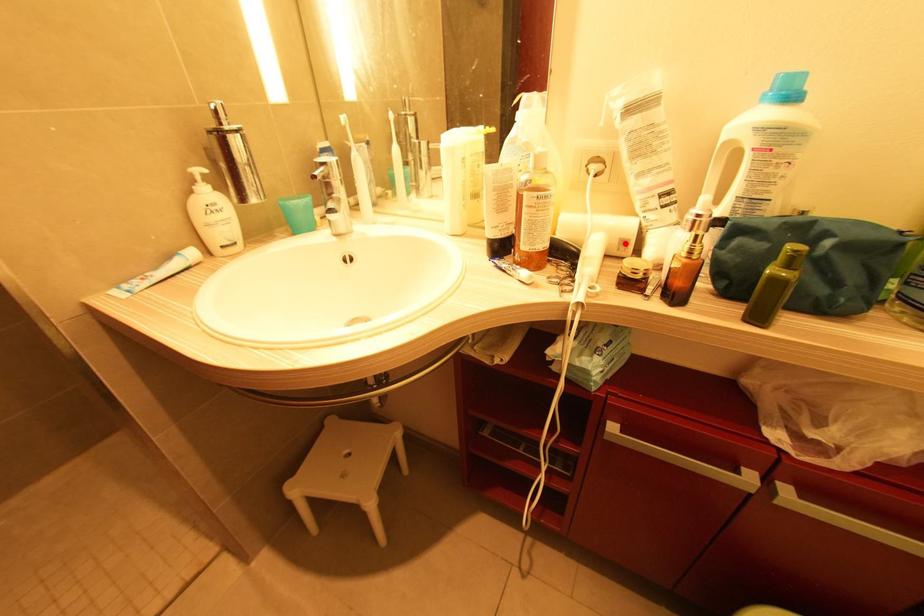
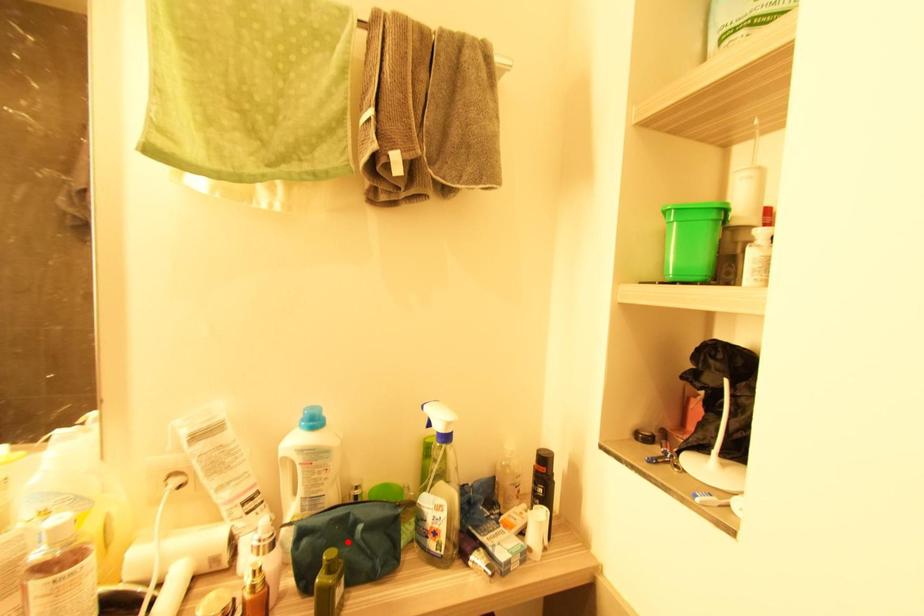
I am providing you with two images of the same scene from different viewpoints. A red point is marked on the first image and another point is marked on the second image. Is the red point in image1 aligned with the point shown in image2?

No